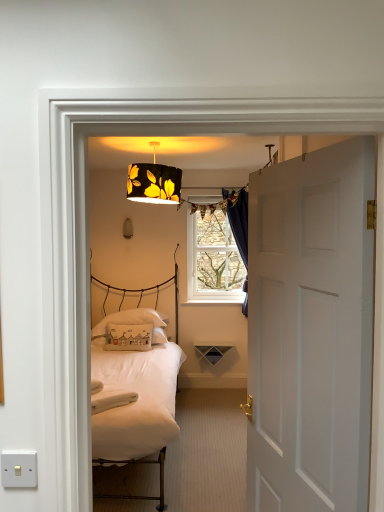
Question: Should I look upward or downward to see dark blue velvet curtain at upper center?

Choices:
 (A) up
 (B) down

Answer: (B)

Question: Does white cotton pillow at center, the second pillow when ordered from back to front, have a greater width compared to white matte door at right?

Choices:
 (A) no
 (B) yes

Answer: (B)

Question: Would you say white matte door at right is part of white cotton pillow at center, the second pillow when ordered from back to front,'s contents?

Choices:
 (A) yes
 (B) no

Answer: (B)

Question: Does white cotton pillow at center, which ranks as the 1th pillow in front-to-back order, touch white matte door at right?

Choices:
 (A) no
 (B) yes

Answer: (A)

Question: Is white cotton pillow at center, the second pillow when ordered from back to front, in front of white matte door at right?

Choices:
 (A) yes
 (B) no

Answer: (B)

Question: From the image's perspective, would you say white cotton pillow at center, the second pillow when ordered from back to front, is positioned over white matte door at right?

Choices:
 (A) yes
 (B) no

Answer: (B)

Question: From a real-world perspective, is white matte door at right physically above dark blue velvet curtain at upper center?

Choices:
 (A) no
 (B) yes

Answer: (A)

Question: Does white matte door at right appear on the left side of dark blue velvet curtain at upper center?

Choices:
 (A) no
 (B) yes

Answer: (B)

Question: Considering the relative sizes of white matte door at right and dark blue velvet curtain at upper center in the image provided, is white matte door at right wider than dark blue velvet curtain at upper center?

Choices:
 (A) yes
 (B) no

Answer: (B)

Question: Does white matte door at right lie in front of dark blue velvet curtain at upper center?

Choices:
 (A) yes
 (B) no

Answer: (A)

Question: From a real-world perspective, is white matte door at right physically below dark blue velvet curtain at upper center?

Choices:
 (A) no
 (B) yes

Answer: (B)

Question: Considering the relative sizes of white matte door at right and dark blue velvet curtain at upper center in the image provided, is white matte door at right taller than dark blue velvet curtain at upper center?

Choices:
 (A) no
 (B) yes

Answer: (B)

Question: Is dark blue velvet curtain at upper center not within white cotton pillow at center, the second pillow when ordered from back to front?

Choices:
 (A) no
 (B) yes

Answer: (B)